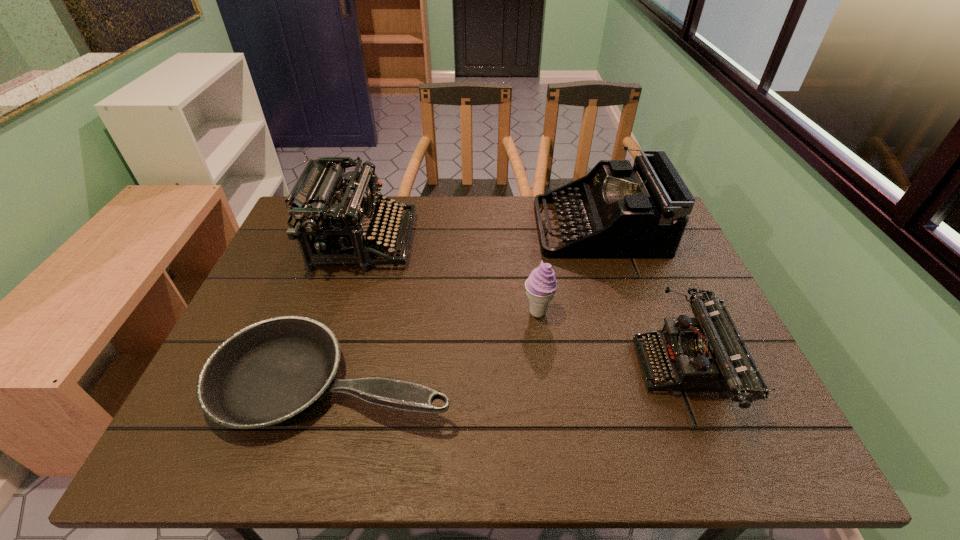
You are a GUI agent. You are given a task and a screenshot of the screen. Output one action in this format:
    pyautogui.click(x=<x>, y=<y>)
    Task: Click on the vacant space at the near edge
    This screenshot has height=540, width=960.
    Given the screenshot: What is the action you would take?
    pyautogui.click(x=517, y=458)

The image size is (960, 540). In order to click on free space at the right edge of the desktop in this screenshot , I will do `click(699, 290)`.

Image resolution: width=960 pixels, height=540 pixels. Find the location of `free spot between the third shortest object and the second shortest object`. free spot between the third shortest object and the second shortest object is located at coordinates (612, 340).

Image resolution: width=960 pixels, height=540 pixels. Identify the location of free spot between the frying pan and the third tallest object. (436, 346).

You are a GUI agent. You are given a task and a screenshot of the screen. Output one action in this format:
    pyautogui.click(x=<x>, y=<y>)
    Task: Click on the empty space between the third shortest object and the shortest typewriter
    
    Given the screenshot: What is the action you would take?
    pyautogui.click(x=612, y=340)

I want to click on vacant area that lies between the nearest typewriter and the third shortest object, so click(x=612, y=340).

The image size is (960, 540). In order to click on vacant space that's between the leftmost typewriter and the second shortest object in this screenshot , I will do `click(525, 305)`.

I want to click on vacant area between the shortest object and the second shortest object, so click(x=509, y=374).

You are a GUI agent. You are given a task and a screenshot of the screen. Output one action in this format:
    pyautogui.click(x=<x>, y=<y>)
    Task: Click on the free point between the shortest typewriter and the leftmost typewriter
    This screenshot has width=960, height=540.
    Given the screenshot: What is the action you would take?
    pyautogui.click(x=525, y=305)

Identify the location of object that can be found as the third closest to the shortest typewriter. The height and width of the screenshot is (540, 960). (271, 371).